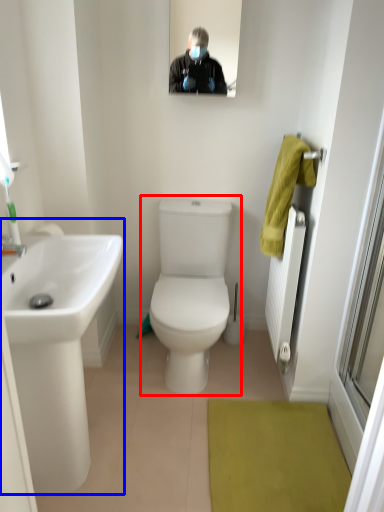
Question: Among these objects, which one is nearest to the camera, toilet (highlighted by a red box) or sink (highlighted by a blue box)?

Choices:
 (A) toilet
 (B) sink

Answer: (B)